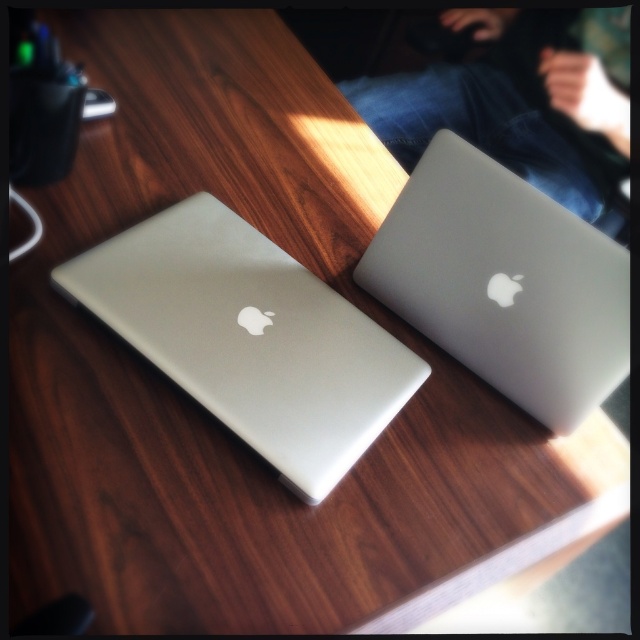
Question: Is sleek silver laptop at center positioned in front of satin silver laptop at upper right?

Choices:
 (A) no
 (B) yes

Answer: (B)

Question: Which point is closer to the camera taking this photo?

Choices:
 (A) (458, 212)
 (B) (184, 224)

Answer: (A)

Question: Can you confirm if sleek silver laptop at center is positioned below satin silver laptop at upper right?

Choices:
 (A) no
 (B) yes

Answer: (B)

Question: Which of the following is the closest to the observer?

Choices:
 (A) (324, 388)
 (B) (406, 221)

Answer: (A)

Question: Does sleek silver laptop at center appear under satin silver laptop at upper right?

Choices:
 (A) no
 (B) yes

Answer: (B)